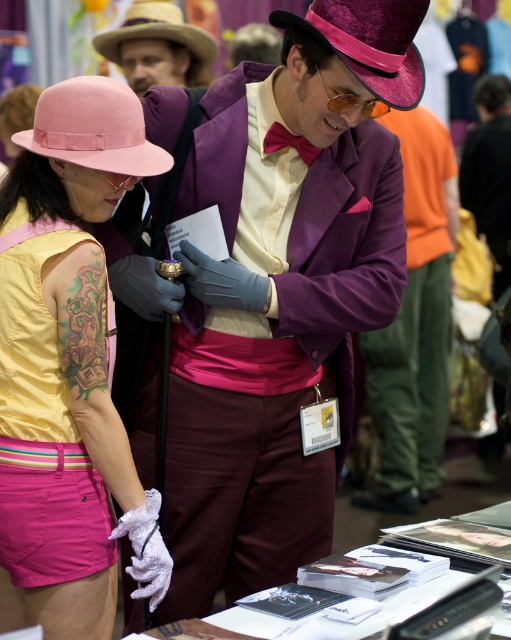
Question: Does purple satin suit at center have a larger size compared to pink fabric dress at lower left?

Choices:
 (A) no
 (B) yes

Answer: (B)

Question: Which object is positioned closest to the purple velvet cowboy hat at upper center?

Choices:
 (A) purple velvet suit at center
 (B) straw cowboy hat at upper left

Answer: (B)

Question: Does purple velvet suit at center appear on the right side of maroon satin bow tie at center?

Choices:
 (A) no
 (B) yes

Answer: (B)

Question: Can you confirm if purple satin suit at center is wider than maroon satin bow tie at center?

Choices:
 (A) yes
 (B) no

Answer: (A)

Question: Which point is farther from the camera taking this photo?

Choices:
 (A) (94, 38)
 (B) (179, 108)
 (C) (72, 104)
 (D) (429, 144)

Answer: (A)

Question: Which is nearer to the pink fabric dress at lower left?

Choices:
 (A) straw cowboy hat at upper left
 (B) matte pink hat at upper left

Answer: (B)